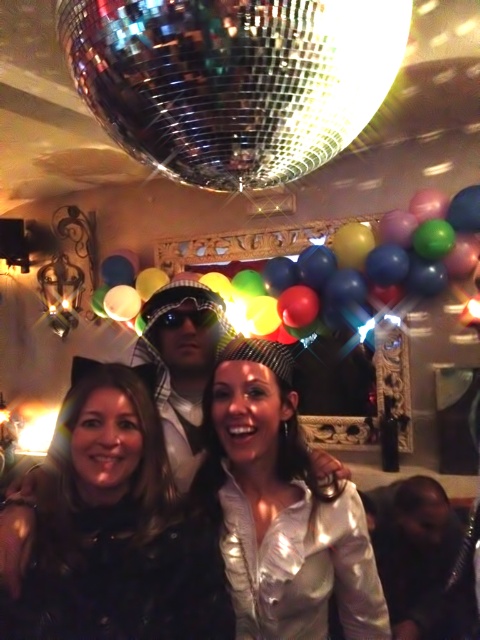
Question: Does shiny silver jacket at center have a larger size compared to shiny metallic balloons at upper center?

Choices:
 (A) no
 (B) yes

Answer: (A)

Question: Is shiny black jacket at center thinner than shiny metallic balloons at upper center?

Choices:
 (A) no
 (B) yes

Answer: (B)

Question: Considering the relative positions of shiny black jacket at center and shiny metallic balloons at upper center in the image provided, where is shiny black jacket at center located with respect to shiny metallic balloons at upper center?

Choices:
 (A) below
 (B) above

Answer: (A)

Question: Which is farther from the shiny silver jacket at center?

Choices:
 (A) shiny metallic balloon at upper center
 (B) shiny black jacket at center

Answer: (A)

Question: Which of these objects is positioned closest to the shiny metallic balloons at upper center?

Choices:
 (A) shiny black jacket at center
 (B) shiny metallic balloon at upper center

Answer: (B)

Question: Which is farther from the shiny silver jacket at center?

Choices:
 (A) shiny metallic balloons at upper center
 (B) shiny black jacket at center

Answer: (A)